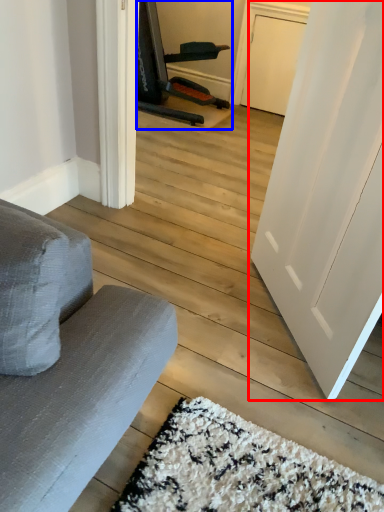
Question: Which object is further to the camera taking this photo, door (highlighted by a red box) or armchair (highlighted by a blue box)?

Choices:
 (A) door
 (B) armchair

Answer: (B)